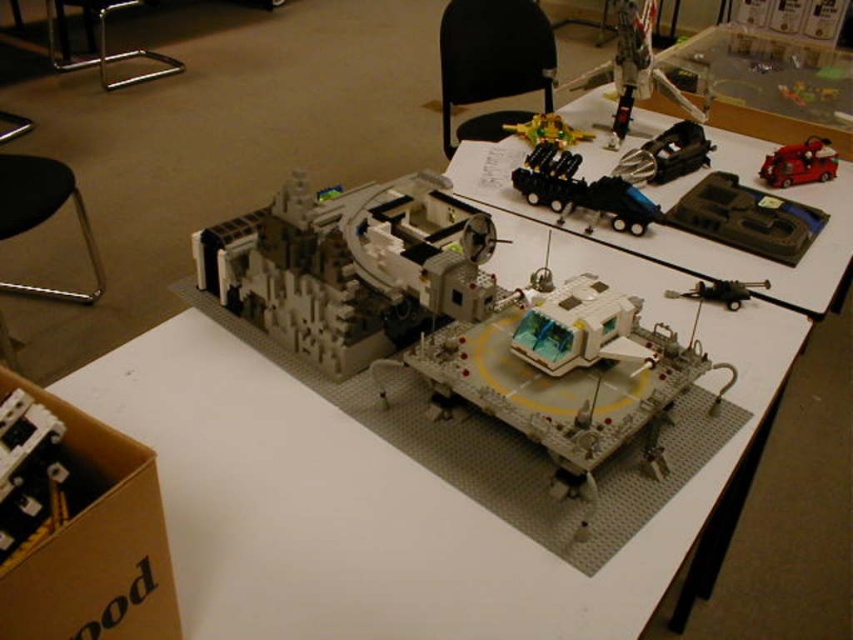
Does translucent plastic bricks at lower left have a lesser width compared to metallic silver gun at center?

Yes.

Locate an element on the screen. This screenshot has width=853, height=640. translucent plastic bricks at lower left is located at coordinates (28, 474).

Is shiny gold spaceship at upper center above metallic silver gun at center?

Correct, shiny gold spaceship at upper center is located above metallic silver gun at center.

What are the coordinates of `shiny gold spaceship at upper center` in the screenshot? It's located at (548, 131).

Image resolution: width=853 pixels, height=640 pixels. Find the location of `shiny gold spaceship at upper center`. shiny gold spaceship at upper center is located at coordinates (548, 131).

Is translucent plastic building at center taller than shiny red car at upper right?

Yes.

The height and width of the screenshot is (640, 853). Describe the element at coordinates (344, 268) in the screenshot. I see `translucent plastic building at center` at that location.

Identify the location of translucent plastic building at center. (344, 268).